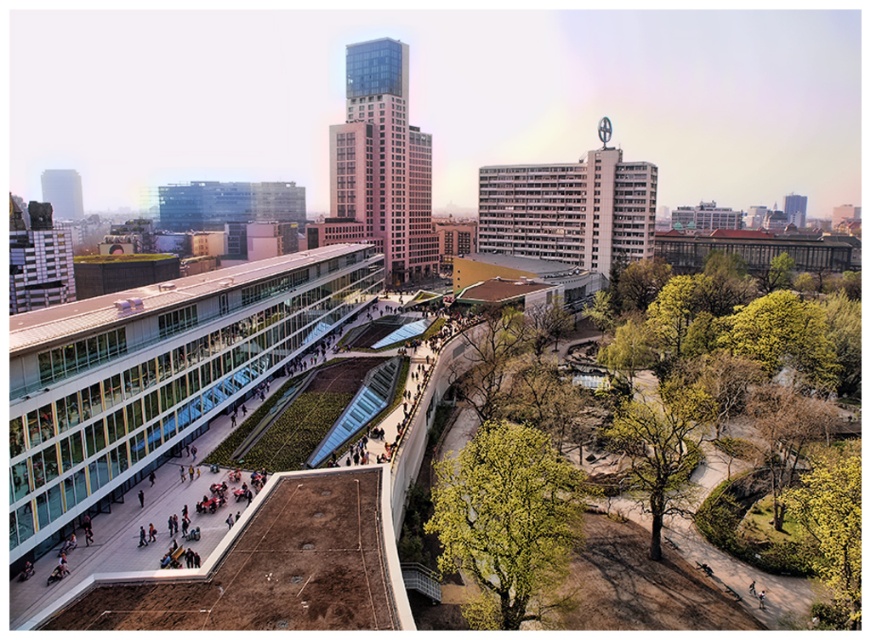
You are standing in the urban landscape and want to take a photo of both the green leafy tree at center and the green leafy tree at lower right. However, you only have space in your camera frame for one tree at a time. Which tree should you focus on first if you want to avoid the other tree blocking your view?

You should focus on the green leafy tree at center first because it is in front of the green leafy tree at lower right, so capturing it first would prevent the lower right tree from being blocked by the center tree when adjusting your frame.

You are a city planner analyzing this urban area. You need to determine which green leafy tree is narrower between the green leafy tree at center and the green leafy tree at lower right. Which one is narrower?

The green leafy tree at center is narrower than the green leafy tree at lower right.

You are standing in the urban landscape and want to determine which of the two points, point (x=485, y=621) or point (x=645, y=451), is nearer to you. Based on the scene, which point is closer?

Point (x=485, y=621) is closer to the viewer than point (x=645, y=451).